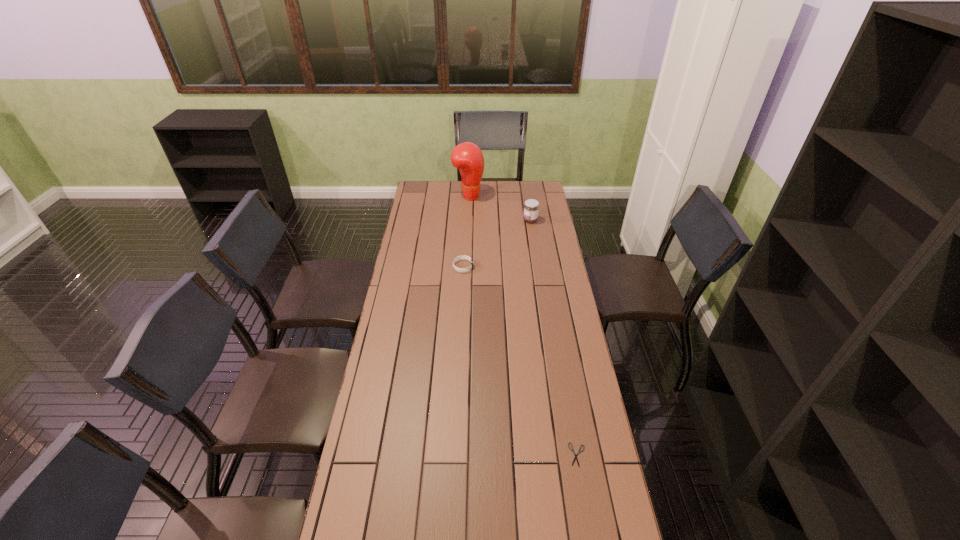
Where is `the farthest object`? This screenshot has width=960, height=540. the farthest object is located at coordinates 467,157.

Identify the location of the tallest object. This screenshot has height=540, width=960. (467, 157).

You are a GUI agent. You are given a task and a screenshot of the screen. Output one action in this format:
    pyautogui.click(x=<x>, y=<y>)
    Task: Click on the third nearest object
    
    Given the screenshot: What is the action you would take?
    pyautogui.click(x=531, y=207)

Where is `jam`? jam is located at coordinates (531, 207).

Find the location of `wristband`. wristband is located at coordinates (460, 257).

This screenshot has width=960, height=540. Identify the location of the third farthest object. (460, 257).

Find the location of a particular element. The width and height of the screenshot is (960, 540). the shortest object is located at coordinates (572, 450).

Where is `the nearest object`? This screenshot has width=960, height=540. the nearest object is located at coordinates (572, 450).

The width and height of the screenshot is (960, 540). What are the coordinates of `vacant space located on the striking surface of the boxing glove` in the screenshot? It's located at (517, 195).

The height and width of the screenshot is (540, 960). I want to click on free point located on the front label of the third shortest object, so click(468, 220).